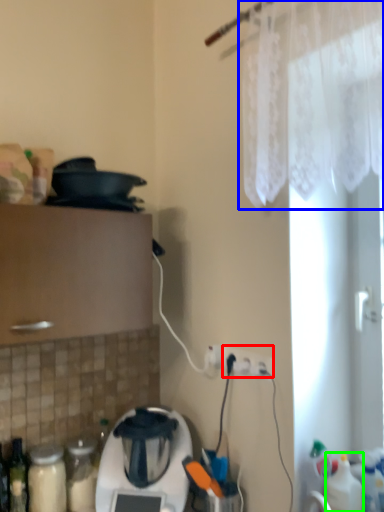
Question: Which object is the closest to the electric outlet (highlighted by a red box)? Choose among these: curtain (highlighted by a blue box) or bottle (highlighted by a green box).

Choices:
 (A) curtain
 (B) bottle

Answer: (B)